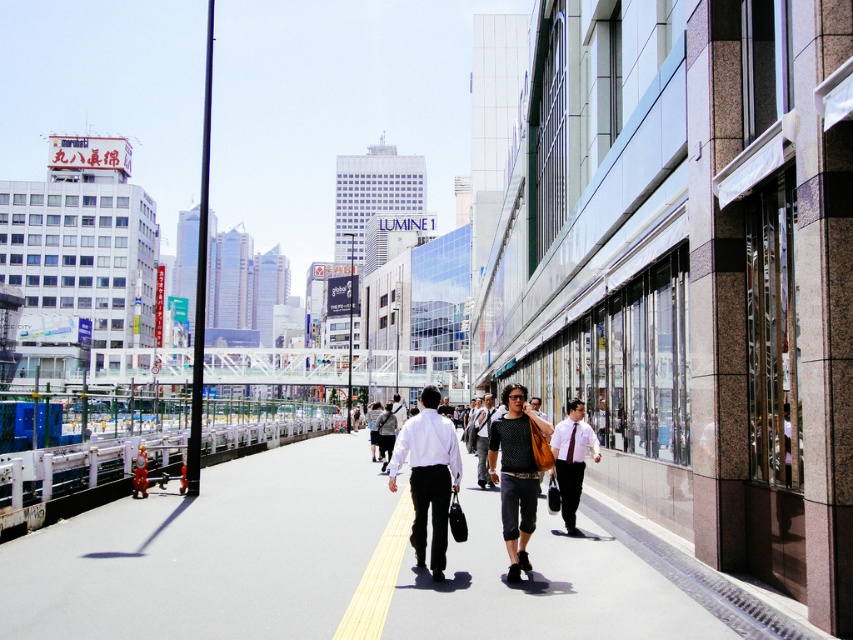
Question: Estimate the real-world distances between objects in this image. Which object is closer to the matte black shirt at center?

Choices:
 (A) smooth asphalt pavement at center
 (B) black textured pants at center
 (C) white glossy shirt at center

Answer: (A)

Question: Can you confirm if smooth asphalt pavement at center is bigger than dark gray textured shirt at center?

Choices:
 (A) yes
 (B) no

Answer: (A)

Question: Among these points, which one is farthest from the camera?

Choices:
 (A) (294, 532)
 (B) (415, 548)
 (C) (523, 468)
 (D) (415, 492)

Answer: (A)

Question: Does smooth asphalt pavement at center have a greater width compared to black textured pants at center?

Choices:
 (A) no
 (B) yes

Answer: (B)

Question: Can you confirm if dark gray textured shirt at center is smaller than white glossy shirt at center?

Choices:
 (A) yes
 (B) no

Answer: (B)

Question: Based on their relative distances, which object is nearer to the matte black shirt at center?

Choices:
 (A) dark gray textured shirt at center
 (B) smooth asphalt pavement at center

Answer: (B)